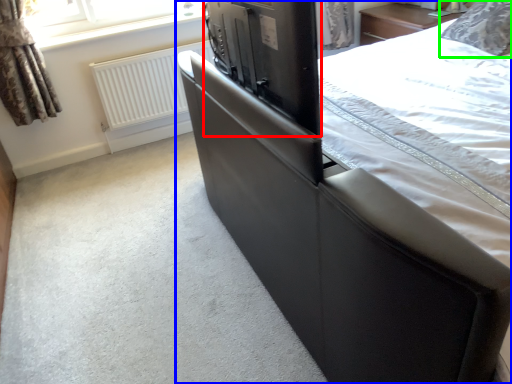
Question: Which object is positioned farthest from appliance (highlighted by a red box)? Select from bed (highlighted by a blue box) and pillow (highlighted by a green box).

Choices:
 (A) bed
 (B) pillow

Answer: (B)